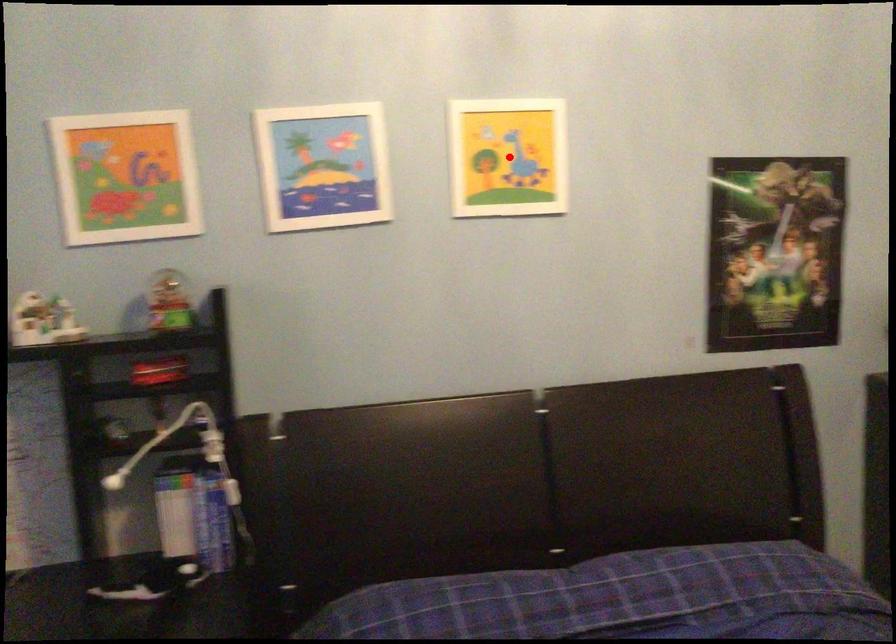
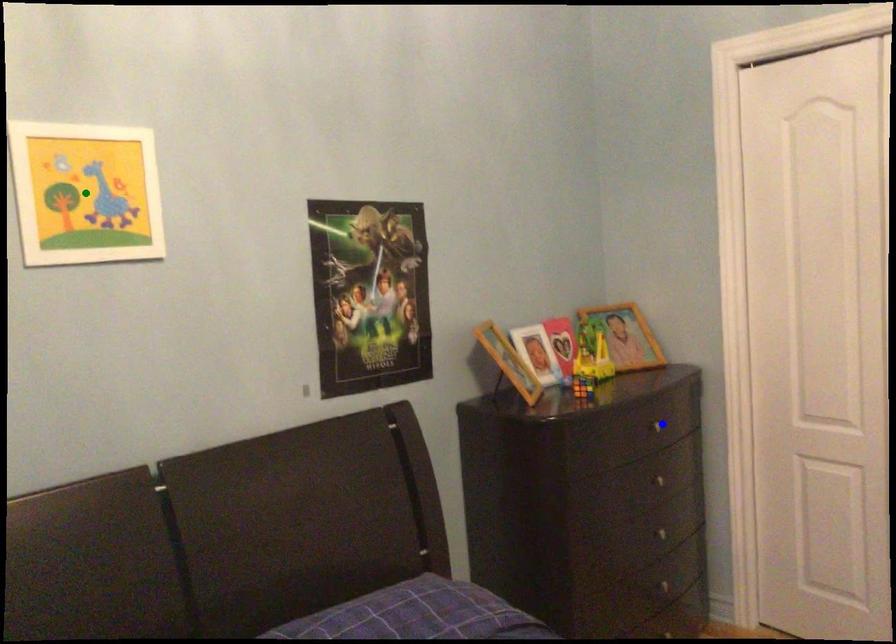
Question: I am providing you with two images of the same scene from different viewpoints. A red point is marked on the first image. You are given multiple points on the second image. Which spot in image 2 lines up with the point in image 1?

Choices:
 (A) yellow point
 (B) blue point
 (C) green point

Answer: (C)